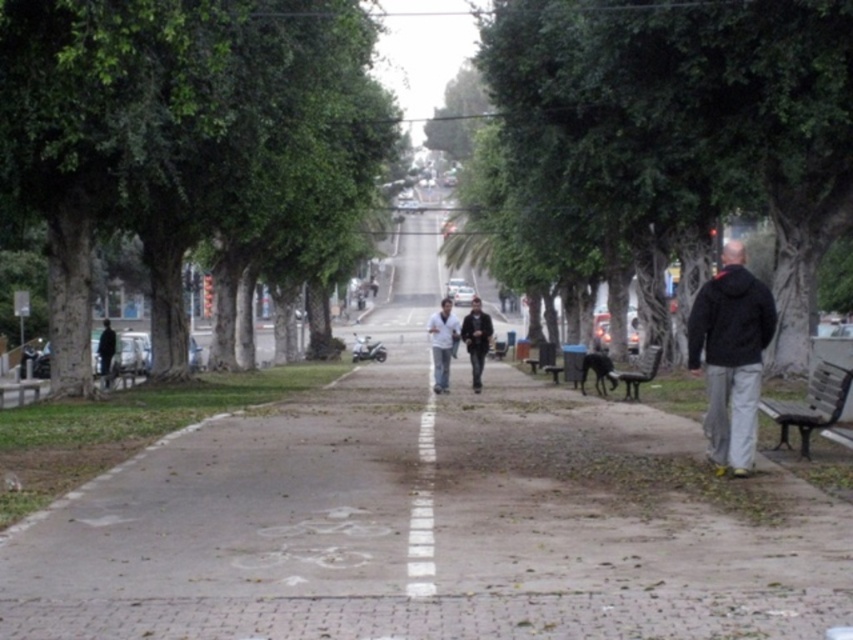
Does black matte jacket at lower right appear on the right side of dark gray jacket at center?

Yes, black matte jacket at lower right is to the right of dark gray jacket at center.

Between point (758, 321) and point (486, 330), which one is positioned behind?

Point (486, 330)

The height and width of the screenshot is (640, 853). Identify the location of black matte jacket at lower right. (730, 356).

Does point (759, 410) lie in front of point (483, 336)?

Yes, point (759, 410) is in front of point (483, 336).

Is wooden bench at right to the left of dark gray jacket at center from the viewer's perspective?

In fact, wooden bench at right is to the right of dark gray jacket at center.

Identify the location of wooden bench at right. (810, 404).

The width and height of the screenshot is (853, 640). Find the location of `wooden bench at right`. wooden bench at right is located at coordinates click(x=810, y=404).

Describe the element at coordinates (434, 522) in the screenshot. I see `paved concrete at center` at that location.

Who is more distant from viewer, (622, 618) or (828, 118)?

The point (828, 118) is more distant.

The width and height of the screenshot is (853, 640). What are the coordinates of `paved concrete at center` in the screenshot? It's located at (434, 522).